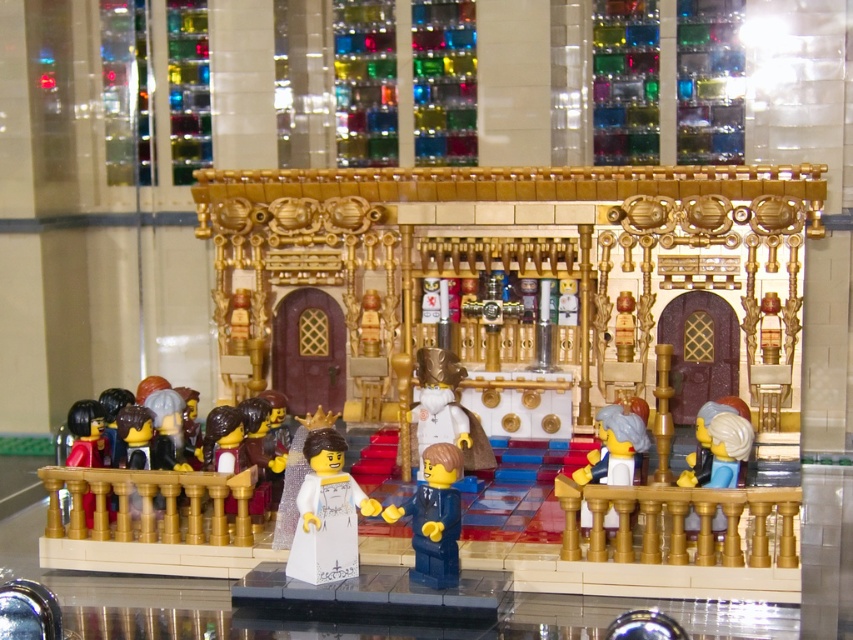
Question: Is white glossy minifigure at center below blue plastic figure at center?

Choices:
 (A) yes
 (B) no

Answer: (B)

Question: In this image, where is blue plastic figure at center located relative to white matte minifigure at right?

Choices:
 (A) above
 (B) below

Answer: (B)

Question: Considering the relative positions of white matte minifigure at right and matte black minifigure at lower left in the image provided, where is white matte minifigure at right located with respect to matte black minifigure at lower left?

Choices:
 (A) left
 (B) right

Answer: (B)

Question: Which point is closer to the camera?

Choices:
 (A) white matte minifigure at right
 (B) blue plastic figure at center
 (C) matte black minifigure at lower left

Answer: (B)

Question: Which object is farther from the camera taking this photo?

Choices:
 (A) white glossy minifigure at center
 (B) blue plastic figure at center
 (C) white matte minifigure at right
 (D) matte black minifigure at lower left

Answer: (D)

Question: Among these points, which one is nearest to the camera?

Choices:
 (A) (624, 444)
 (B) (296, 545)
 (C) (422, 550)
 (D) (90, 410)

Answer: (C)